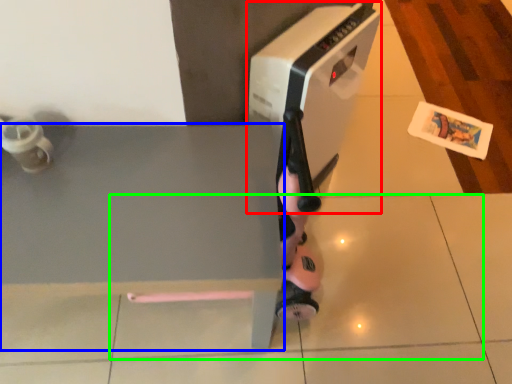
Question: Which object is positioned farthest from home appliance (highlighted by a red box)? Select from table (highlighted by a blue box) and tile (highlighted by a green box).

Choices:
 (A) table
 (B) tile

Answer: (B)